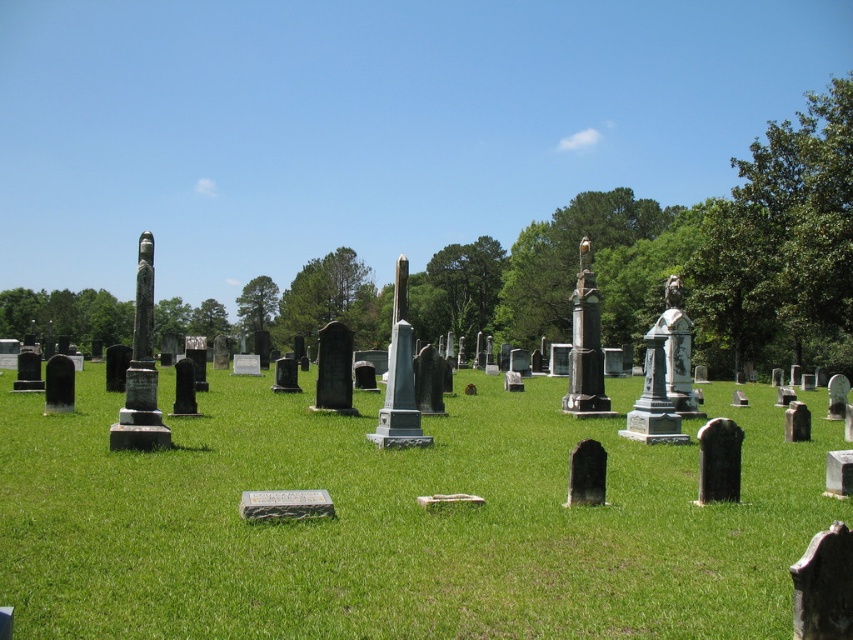
You are a gardener planning to mow the green grass at center and trim the green leafy tree at center. Based on their widths, which task requires more attention to avoid damaging the other? Please explain.

The green grass at center has a larger width than the green leafy tree at center. Therefore, mowing the green grass at center requires more attention to avoid accidentally trimming the tree, as the grass area is wider and closer to the tree.